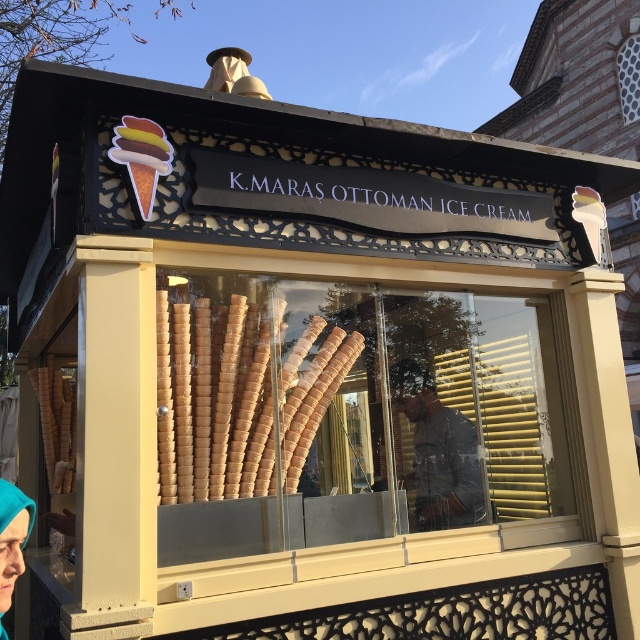
You are a customer at the ice cream stall and want to take a photo of the golden waffle cone at center and the dark gray fabric at center. Which object will appear larger in your photo?

The golden waffle cone at center is closer to the viewer than the dark gray fabric at center, so it will appear larger in the photo.